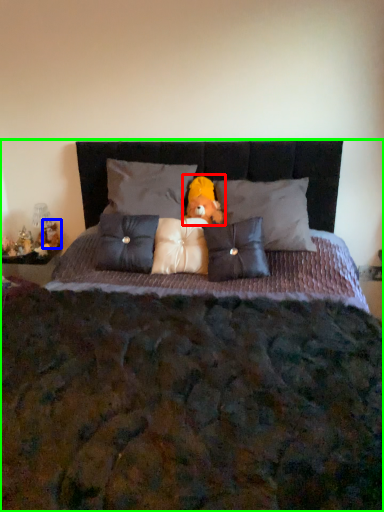
Question: Which object is positioned closest to doll (highlighted by a red box)? Select from figurine (highlighted by a blue box) and bed (highlighted by a green box).

Choices:
 (A) figurine
 (B) bed

Answer: (B)